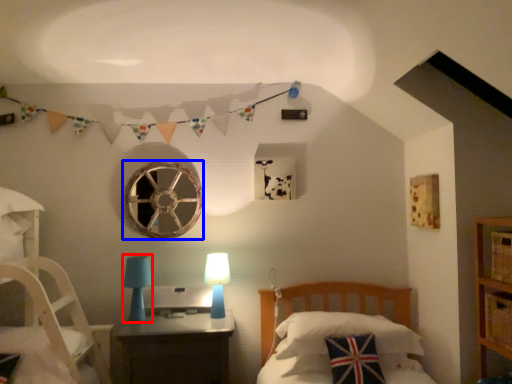
Question: Which object is further to the camera taking this photo, table lamp (highlighted by a red box) or oval (highlighted by a blue box)?

Choices:
 (A) table lamp
 (B) oval

Answer: (B)